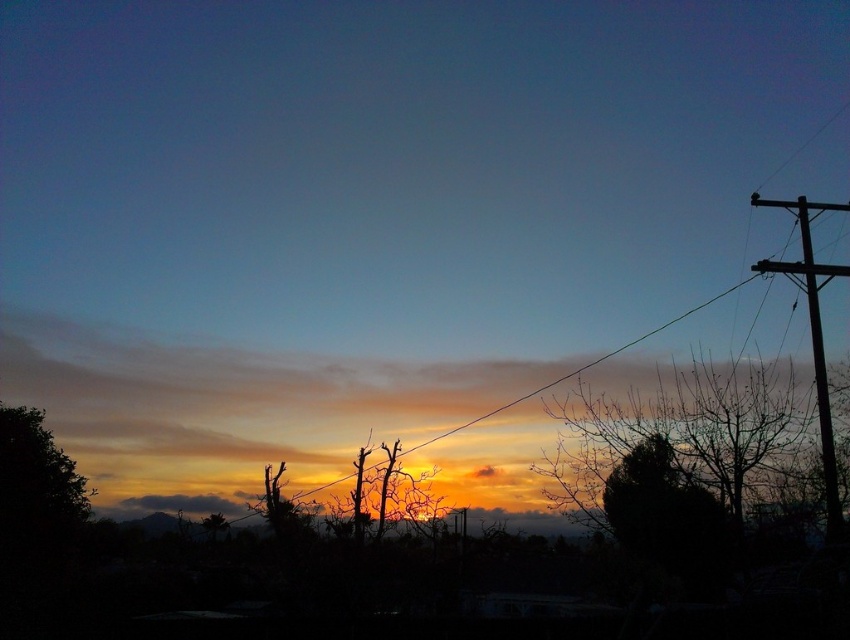
Question: Does dark green leafy tree at lower left appear on the left side of brown wooden telegraph pole at right?

Choices:
 (A) yes
 (B) no

Answer: (A)

Question: Which object is closer to the camera taking this photo?

Choices:
 (A) green wire at center
 (B) brown wooden telegraph pole at right
 (C) dark green leafy tree at lower left

Answer: (B)

Question: Among these objects, which one is farthest from the camera?

Choices:
 (A) green wire at center
 (B) dark green leafy tree at lower left
 (C) silhouette leafless at right
 (D) brown wooden telegraph pole at right

Answer: (B)

Question: Is dark green leafy tree at lower left to the left of green wire at center from the viewer's perspective?

Choices:
 (A) no
 (B) yes

Answer: (B)

Question: Can you confirm if brown wooden telegraph pole at right is smaller than green wire at center?

Choices:
 (A) yes
 (B) no

Answer: (A)

Question: Which point is farther to the camera?

Choices:
 (A) silhouette leafless at right
 (B) brown wooden telegraph pole at right

Answer: (A)